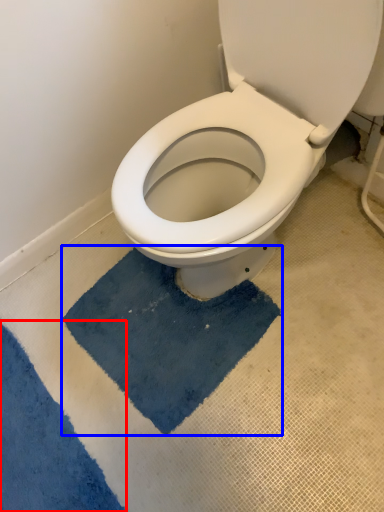
Question: Which object appears farthest to the camera in this image, bath mat (highlighted by a red box) or bath mat (highlighted by a blue box)?

Choices:
 (A) bath mat
 (B) bath mat

Answer: (B)